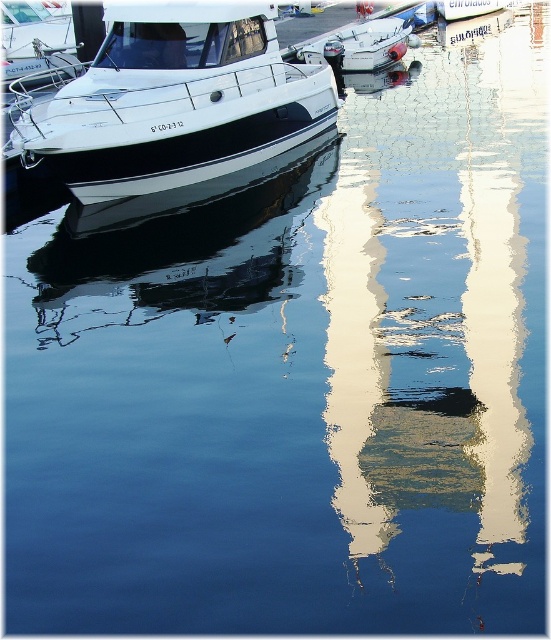
Is point (169, 65) positioned before point (345, 64)?

Yes, point (169, 65) is in front of point (345, 64).

Can you confirm if white glossy boat at upper left is shorter than white glossy boat at upper center?

Correct, white glossy boat at upper left is not as tall as white glossy boat at upper center.

The width and height of the screenshot is (551, 640). What are the coordinates of `white glossy boat at upper left` in the screenshot? It's located at (175, 102).

The width and height of the screenshot is (551, 640). I want to click on white glossy boat at upper left, so click(175, 102).

Which of these two, white glossy boat at upper left or white glossy boat at center, stands shorter?

With less height is white glossy boat at upper left.

Is white glossy boat at upper left smaller than white glossy boat at center?

Correct, white glossy boat at upper left occupies less space than white glossy boat at center.

Who is more distant from viewer, (289, 97) or (453, 12)?

Positioned behind is point (453, 12).

Identify the location of white glossy boat at upper left. Image resolution: width=551 pixels, height=640 pixels. (175, 102).

Between white glossy boat at upper center and white glossy boat at center, which one is positioned higher?

white glossy boat at center

The width and height of the screenshot is (551, 640). I want to click on white glossy boat at upper center, so click(x=370, y=44).

At what (x,y) coordinates should I click in order to perform the action: click on white glossy boat at upper center. Please return your answer as a coordinate pair (x, y). Looking at the image, I should click on (370, 44).